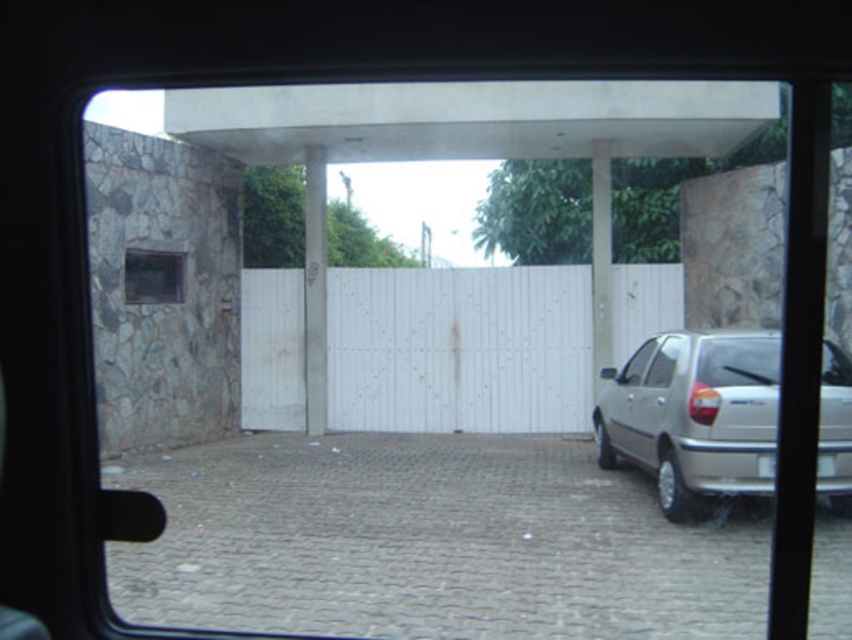
Is white smooth pillar at center wider than transparent glass window at right?

Correct, the width of white smooth pillar at center exceeds that of transparent glass window at right.

Who is positioned more to the right, white smooth pillar at center or transparent glass window at right?

white smooth pillar at center is more to the right.

Does point (593, 188) lie behind point (671, 349)?

That is True.

Identify the location of white smooth pillar at center. (600, 259).

Is gray cobblestone driveway at center wider than white smooth pole at center?

In fact, gray cobblestone driveway at center might be narrower than white smooth pole at center.

Looking at this image, can you confirm if gray cobblestone driveway at center is shorter than white smooth pole at center?

Yes.

Between point (494, 490) and point (318, 212), which one is positioned in front?

Point (494, 490) is in front.

Where is `gray cobblestone driveway at center`? gray cobblestone driveway at center is located at coordinates (432, 541).

Can you confirm if gray cobblestone driveway at center is shorter than white smooth pillar at center?

Yes.

What are the coordinates of `gray cobblestone driveway at center` in the screenshot? It's located at (432, 541).

Is point (493, 520) less distant than point (602, 180)?

Yes, it is in front of point (602, 180).

Where is `gray cobblestone driveway at center`? The image size is (852, 640). gray cobblestone driveway at center is located at coordinates (432, 541).